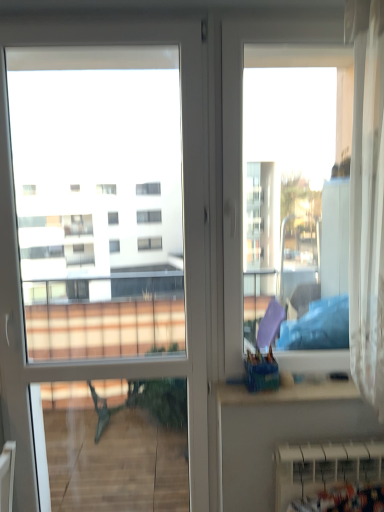
Question: In terms of height, does white glossy door at left look taller or shorter compared to white plastic radiator at lower right?

Choices:
 (A) short
 (B) tall

Answer: (B)

Question: Looking at their shapes, would you say white glossy door at left is wider or thinner than white plastic radiator at lower right?

Choices:
 (A) wide
 (B) thin

Answer: (B)

Question: Is point (4, 216) closer or farther from the camera than point (281, 449)?

Choices:
 (A) farther
 (B) closer

Answer: (B)

Question: In the image, is white plastic radiator at lower right positioned in front of or behind white glossy door at left?

Choices:
 (A) behind
 (B) front

Answer: (A)

Question: Is white plastic radiator at lower right bigger or smaller than white glossy door at left?

Choices:
 (A) big
 (B) small

Answer: (B)

Question: Considering the positions of white plastic radiator at lower right and white glossy door at left in the image, is white plastic radiator at lower right wider or thinner than white glossy door at left?

Choices:
 (A) wide
 (B) thin

Answer: (A)

Question: Considering the positions of point (349, 467) and point (1, 47), is point (349, 467) closer or farther from the camera than point (1, 47)?

Choices:
 (A) closer
 (B) farther

Answer: (A)